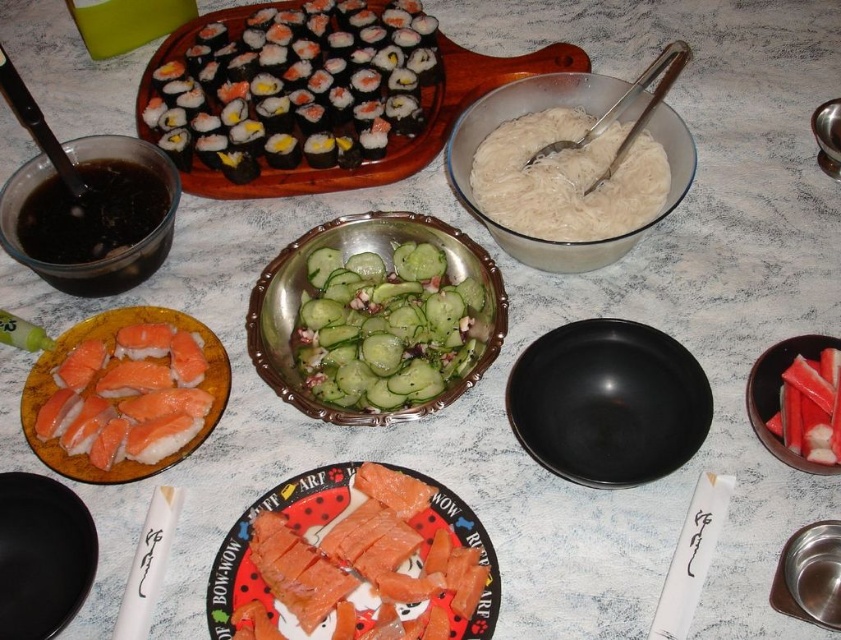
You are a food delivery person who needs to place a hot bowl of soup on the table without touching the black rice paper wrapped sushi at upper left or the black matte plate at lower left. The bowl has a diameter of 25 centimeters. Is there enough space between the two objects to place the bowl?

The black rice paper wrapped sushi at upper left and black matte plate at lower left are 56.78 centimeters apart. The bowl has a diameter of 25 centimeters, so there is sufficient space between them to place the bowl without touching either object.

You are preparing to serve a dish and need to know which object is smaller between the pinkish salmon at center and the black rice paper wrapped sushi at upper left. Which one should you choose?

The pinkish salmon at center is smaller in size compared to the black rice paper wrapped sushi at upper left, so you should choose the pinkish salmon at center.

You are a food photographer setting up a shot. You have to decide whether to focus on the black rice paper wrapped sushi at upper left or the black matte plate at lower left first. Which one should you focus on first if you want to capture the closest object?

The black rice paper wrapped sushi at upper left is closer to the viewer than the black matte plate at lower left, so you should focus on the black rice paper wrapped sushi at upper left first.